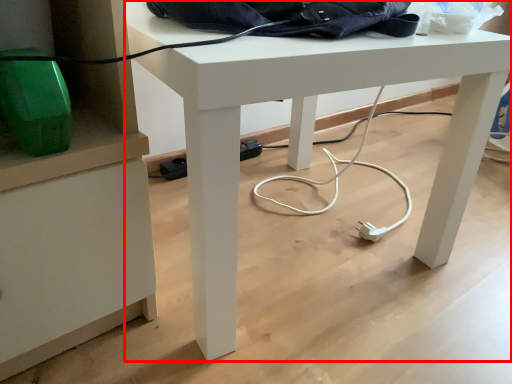
Question: In this image, where is desk (annotated by the red box) located relative to messenger bag?

Choices:
 (A) right
 (B) left

Answer: (B)